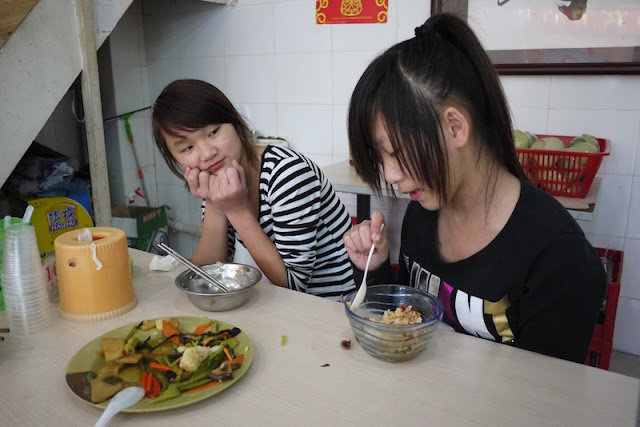
I want to click on light green circular plate, so coord(180,403).